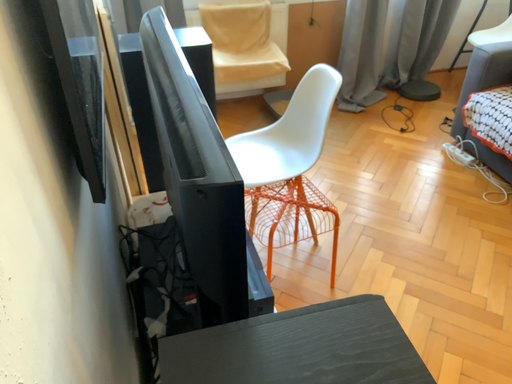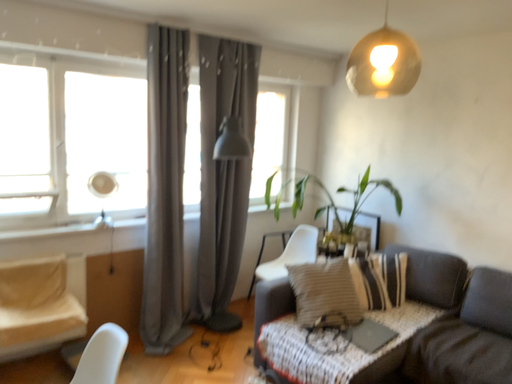
Question: Which way did the camera rotate in the video?

Choices:
 (A) rotated downward
 (B) rotated upward

Answer: (B)